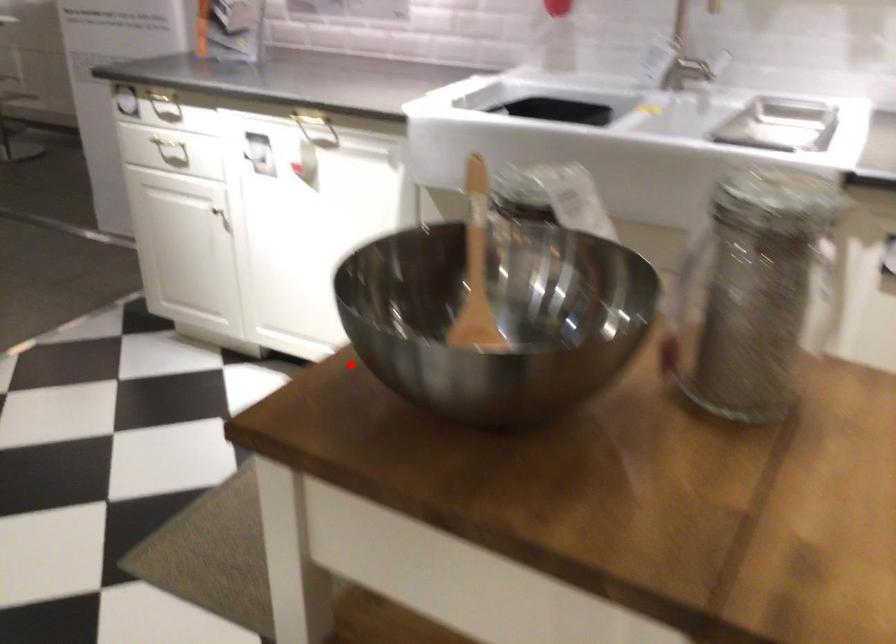
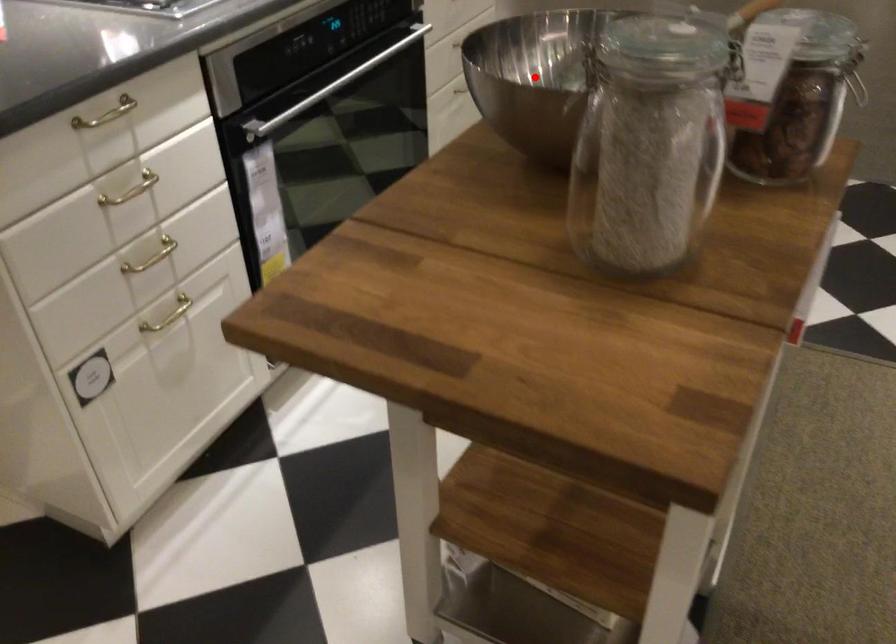
I am providing you with two images of the same scene from different viewpoints. A red point is marked on the first image and another point is marked on the second image. Is the marked point in image1 the same physical position as the marked point in image2?

Yes